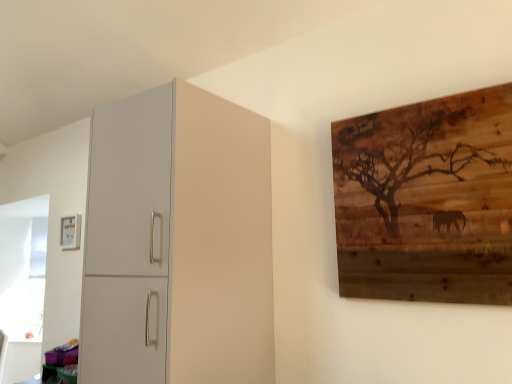
Question: From the image's perspective, is matte white picture frame at upper left, which is counted as the 2th picture frame, starting from the front, on top of matte white cabinet at left?

Choices:
 (A) no
 (B) yes

Answer: (A)

Question: Considering the relative sizes of matte white picture frame at upper left, the 1th picture frame when ordered from left to right, and matte white cabinet at left in the image provided, is matte white picture frame at upper left, the 1th picture frame when ordered from left to right, bigger than matte white cabinet at left?

Choices:
 (A) no
 (B) yes

Answer: (A)

Question: Considering the relative sizes of matte white picture frame at upper left, the 1th picture frame when ordered from left to right, and matte white cabinet at left in the image provided, is matte white picture frame at upper left, the 1th picture frame when ordered from left to right, taller than matte white cabinet at left?

Choices:
 (A) yes
 (B) no

Answer: (B)

Question: From a real-world perspective, is matte white picture frame at upper left, marked as the second picture frame in a right-to-left arrangement, below matte white cabinet at left?

Choices:
 (A) yes
 (B) no

Answer: (B)

Question: Is matte white picture frame at upper left, marked as the second picture frame in a right-to-left arrangement, not close to matte white cabinet at left?

Choices:
 (A) yes
 (B) no

Answer: (A)

Question: From a real-world perspective, is wooden artwork at upper right, acting as the 2th picture frame starting from the left, physically located above or below matte white cabinet at left?

Choices:
 (A) below
 (B) above

Answer: (B)

Question: From their relative heights in the image, would you say wooden artwork at upper right, arranged as the 1th picture frame when viewed from the front, is taller or shorter than matte white cabinet at left?

Choices:
 (A) tall
 (B) short

Answer: (B)

Question: Is wooden artwork at upper right, acting as the 2th picture frame starting from the left, in front of or behind matte white cabinet at left in the image?

Choices:
 (A) front
 (B) behind

Answer: (A)

Question: Would you say wooden artwork at upper right, arranged as the 1th picture frame when viewed from the front, is to the left or to the right of matte white cabinet at left in the picture?

Choices:
 (A) right
 (B) left

Answer: (A)

Question: Is matte white picture frame at upper left, the first picture frame in the back-to-front sequence, taller or shorter than wooden artwork at upper right, arranged as the 1th picture frame when viewed from the front?

Choices:
 (A) short
 (B) tall

Answer: (A)

Question: Looking at their shapes, would you say matte white picture frame at upper left, which is counted as the 2th picture frame, starting from the front, is wider or thinner than wooden artwork at upper right, the 1th picture frame from the right?

Choices:
 (A) thin
 (B) wide

Answer: (A)

Question: Considering the positions of point (62, 226) and point (384, 221), is point (62, 226) closer or farther from the camera than point (384, 221)?

Choices:
 (A) closer
 (B) farther

Answer: (B)

Question: Is matte white picture frame at upper left, the first picture frame in the back-to-front sequence, inside the boundaries of wooden artwork at upper right, arranged as the second picture frame when viewed from the back, or outside?

Choices:
 (A) outside
 (B) inside

Answer: (A)

Question: From the image's perspective, is matte white cabinet at left above or below matte white picture frame at upper left, which is counted as the 2th picture frame, starting from the front?

Choices:
 (A) above
 (B) below

Answer: (A)

Question: From a real-world perspective, relative to matte white picture frame at upper left, the first picture frame in the back-to-front sequence, is matte white cabinet at left vertically above or below?

Choices:
 (A) below
 (B) above

Answer: (A)